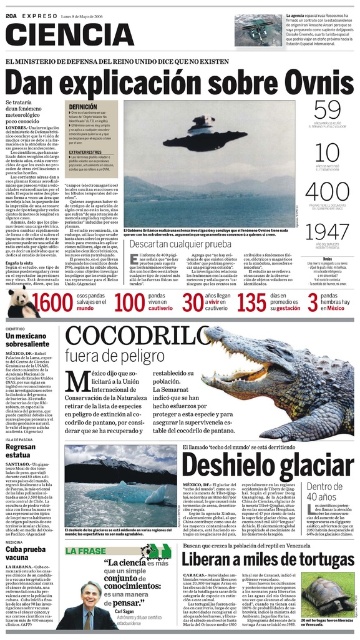
Between shiny brown crocodile at center and matte gray crocodile at center, which one is positioned lower?

matte gray crocodile at center

Between point (275, 384) and point (329, 605), which one is positioned in front?

Point (329, 605) is in front.

Between point (340, 385) and point (344, 608), which one is positioned behind?

Point (340, 385)

The image size is (360, 640). Identify the location of shiny brown crocodile at center. (290, 385).